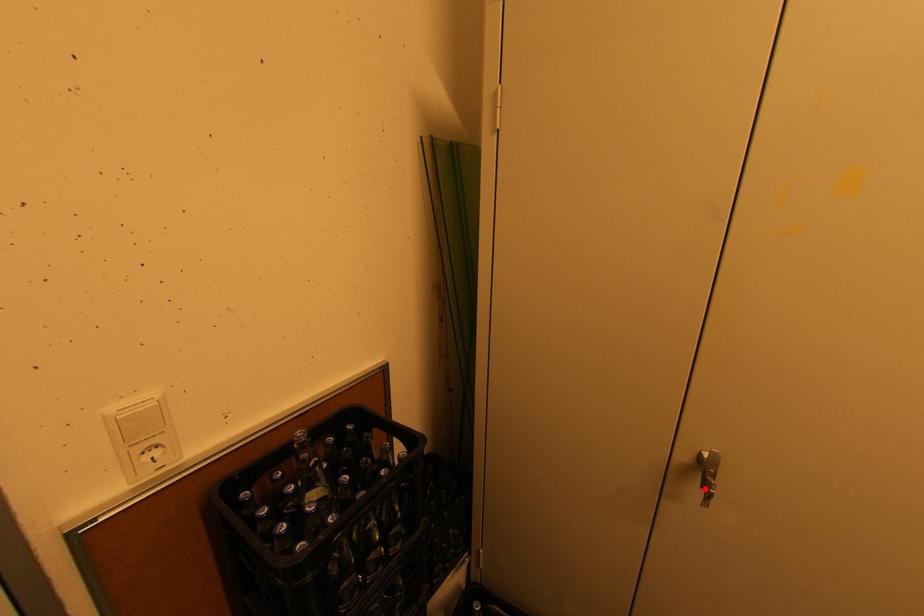
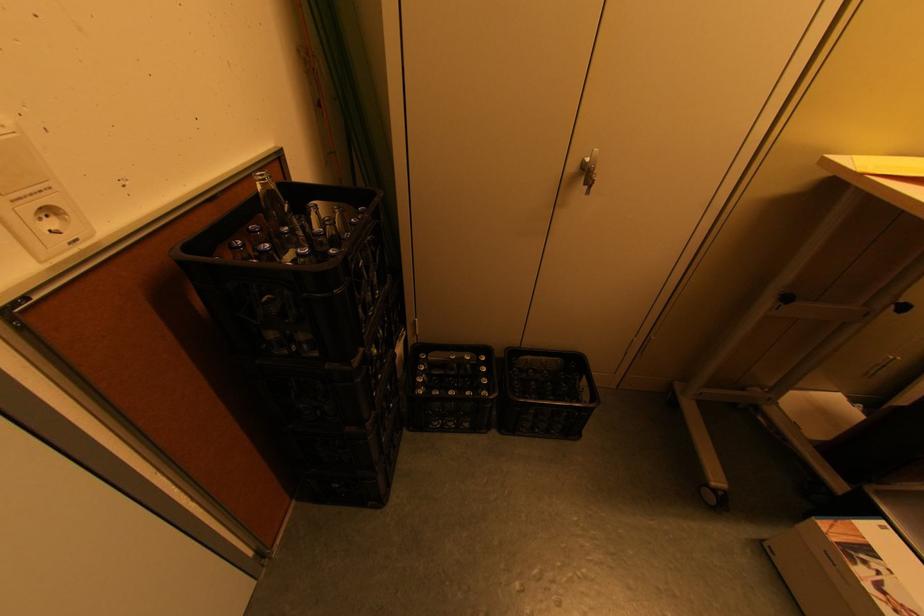
Where in the second image is the point corresponding to the highlighted location from the first image?

(588, 185)